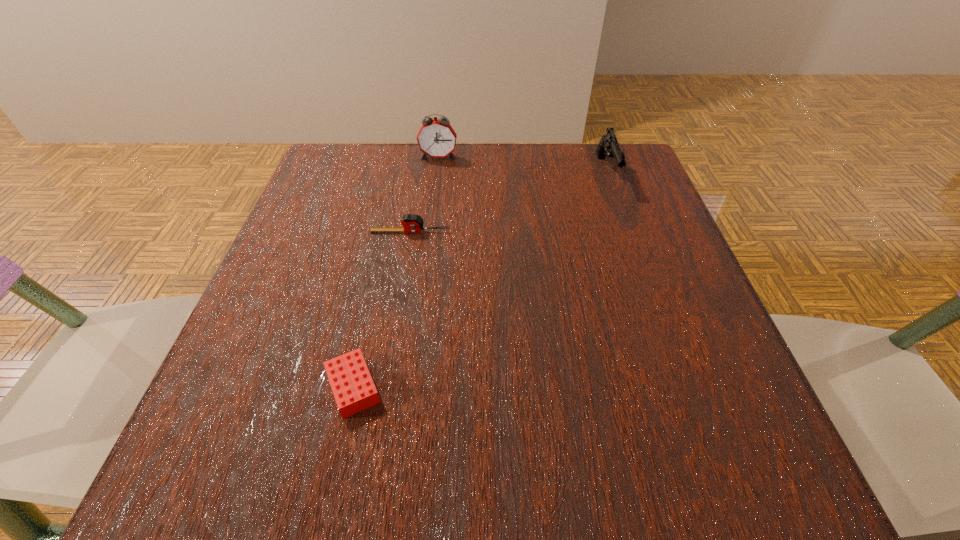
Locate an element on the screen. free space between the alarm clock and the nearest object is located at coordinates (396, 272).

This screenshot has height=540, width=960. I want to click on free area in between the alarm clock and the third shortest object, so click(522, 165).

At what (x,y) coordinates should I click in order to perform the action: click on free space between the second tallest object and the shortest object. Please return your answer as a coordinate pair (x, y). Looking at the image, I should click on (480, 280).

Image resolution: width=960 pixels, height=540 pixels. I want to click on the second closest object to the third shortest object, so click(x=411, y=223).

Identify which object is the nearest to the alarm clock. Please provide its 2D coordinates. Your answer should be formatted as a tuple, i.e. [(x, y)], where the tuple contains the x and y coordinates of a point satisfying the conditions above.

[(411, 223)]